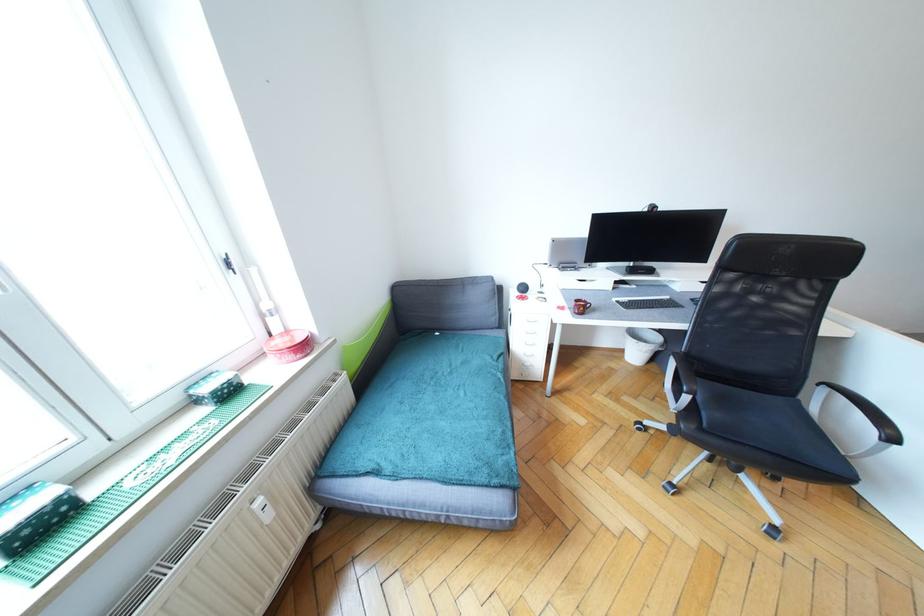
This screenshot has width=924, height=616. Describe the element at coordinates (530, 321) in the screenshot. I see `the white drawer handle` at that location.